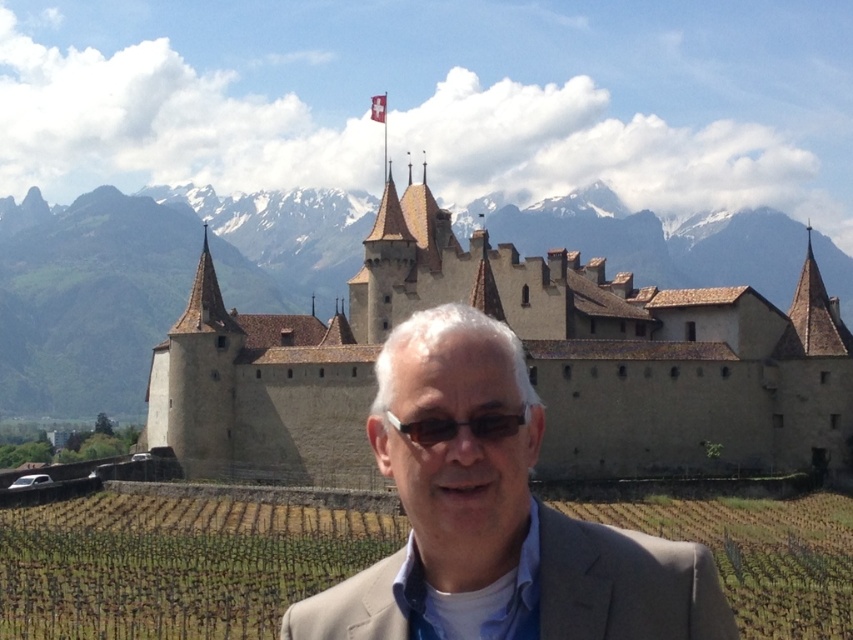
Based on the scene description, where is the beige stone castle at center located relative to the light brown suit at center?

The beige stone castle at center is to the left of the light brown suit at center.

You are a photographer standing at the location of the light brown suit at center. You want to take a photo of the beige stone castle at center. Given that your camera has a maximum focus range of 40 feet, will you be able to capture the castle clearly?

The distance between the beige stone castle at center and the light brown suit at center is 41.54 feet, which exceeds the camera maximum focus range of 40 feet. Therefore, the castle will not be in clear focus.